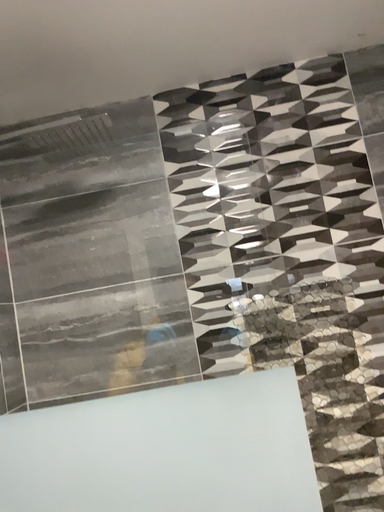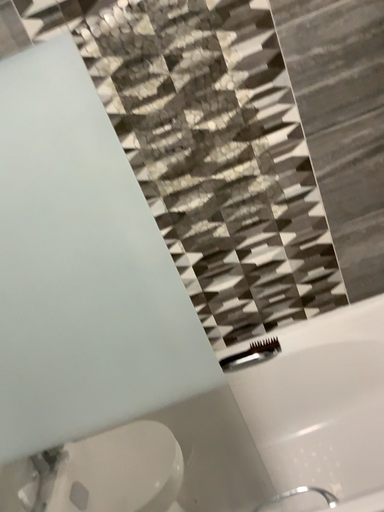
Question: How did the camera likely rotate when shooting the video?

Choices:
 (A) rotated left
 (B) rotated right

Answer: (B)